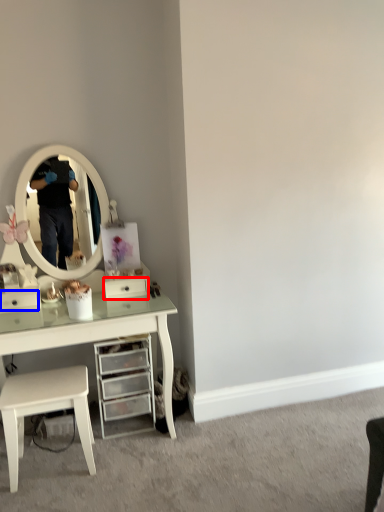
Question: Which object is closer to the camera taking this photo, drawer (highlighted by a red box) or drawer (highlighted by a blue box)?

Choices:
 (A) drawer
 (B) drawer

Answer: (B)